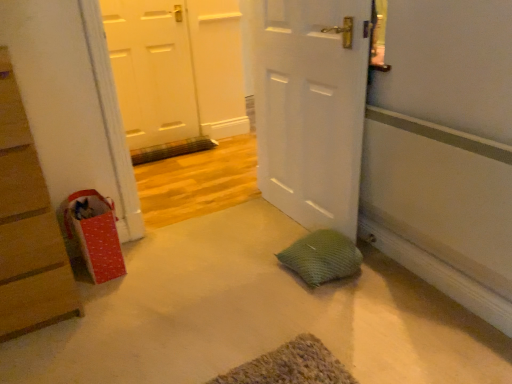
Question: Does red dotted paper bag at left lie behind wooden vent at center?

Choices:
 (A) yes
 (B) no

Answer: (B)

Question: From a real-world perspective, is red dotted paper bag at left on top of wooden vent at center?

Choices:
 (A) no
 (B) yes

Answer: (B)

Question: From a real-world perspective, does red dotted paper bag at left sit lower than wooden vent at center?

Choices:
 (A) no
 (B) yes

Answer: (A)

Question: Is red dotted paper bag at left smaller than wooden vent at center?

Choices:
 (A) yes
 (B) no

Answer: (B)

Question: Is red dotted paper bag at left not inside wooden vent at center?

Choices:
 (A) no
 (B) yes

Answer: (B)

Question: Can you confirm if red dotted paper bag at left is positioned to the right of wooden vent at center?

Choices:
 (A) no
 (B) yes

Answer: (A)

Question: From a real-world perspective, is wooden vent at center located higher than white matte door at center, which appears as the 2th door when viewed from the left?

Choices:
 (A) yes
 (B) no

Answer: (B)

Question: Is white matte door at center, which appears as the 2th door when viewed from the back, surrounded by wooden vent at center?

Choices:
 (A) yes
 (B) no

Answer: (B)

Question: Is wooden vent at center to the right of white matte door at center, which ranks as the 1th door in right-to-left order, from the viewer's perspective?

Choices:
 (A) no
 (B) yes

Answer: (A)

Question: Are wooden vent at center and white matte door at center, the first door in the front-to-back sequence, making contact?

Choices:
 (A) yes
 (B) no

Answer: (B)

Question: Does wooden vent at center appear on the left side of white matte door at center, which ranks as the 1th door in right-to-left order?

Choices:
 (A) no
 (B) yes

Answer: (B)

Question: Is wooden vent at center shorter than white matte door at center, which appears as the 2th door when viewed from the back?

Choices:
 (A) yes
 (B) no

Answer: (A)

Question: Considering the relative sizes of white matte door at upper left, the first door from the left, and green mesh pillow at center in the image provided, is white matte door at upper left, the first door from the left, shorter than green mesh pillow at center?

Choices:
 (A) no
 (B) yes

Answer: (A)